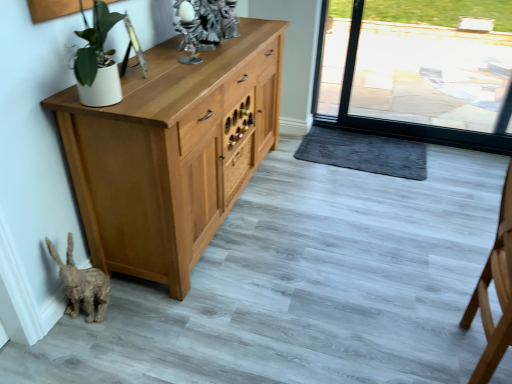
Question: From a real-world perspective, is dark gray plush doormat at lower center located higher than wooden drawer at center?

Choices:
 (A) yes
 (B) no

Answer: (B)

Question: Is dark gray plush doormat at lower center located outside wooden drawer at center?

Choices:
 (A) yes
 (B) no

Answer: (A)

Question: Can you confirm if dark gray plush doormat at lower center is taller than wooden drawer at center?

Choices:
 (A) yes
 (B) no

Answer: (B)

Question: Is dark gray plush doormat at lower center closer to camera compared to wooden drawer at center?

Choices:
 (A) yes
 (B) no

Answer: (B)

Question: Is dark gray plush doormat at lower center smaller than wooden drawer at center?

Choices:
 (A) no
 (B) yes

Answer: (A)

Question: Considering their positions, is light brown wooden chair at right located in front of or behind wooden drawer at center?

Choices:
 (A) behind
 (B) front

Answer: (B)

Question: Is light brown wooden chair at right taller or shorter than wooden drawer at center?

Choices:
 (A) tall
 (B) short

Answer: (A)

Question: Considering the positions of light brown wooden chair at right and wooden drawer at center in the image, is light brown wooden chair at right wider or thinner than wooden drawer at center?

Choices:
 (A) wide
 (B) thin

Answer: (A)

Question: Based on their sizes in the image, would you say light brown wooden chair at right is bigger or smaller than wooden drawer at center?

Choices:
 (A) big
 (B) small

Answer: (A)

Question: Does point (310, 137) appear closer or farther from the camera than point (480, 294)?

Choices:
 (A) closer
 (B) farther

Answer: (B)

Question: Looking at the image, does dark gray plush doormat at lower center seem bigger or smaller compared to light brown wooden chair at right?

Choices:
 (A) big
 (B) small

Answer: (B)

Question: From the image's perspective, is dark gray plush doormat at lower center located above or below light brown wooden chair at right?

Choices:
 (A) below
 (B) above

Answer: (B)

Question: Is dark gray plush doormat at lower center taller or shorter than light brown wooden chair at right?

Choices:
 (A) tall
 (B) short

Answer: (B)

Question: Looking at their shapes, would you say wooden drawer at center is wider or thinner than light brown wooden chair at right?

Choices:
 (A) thin
 (B) wide

Answer: (A)

Question: Is wooden drawer at center inside or outside of light brown wooden chair at right?

Choices:
 (A) outside
 (B) inside

Answer: (A)